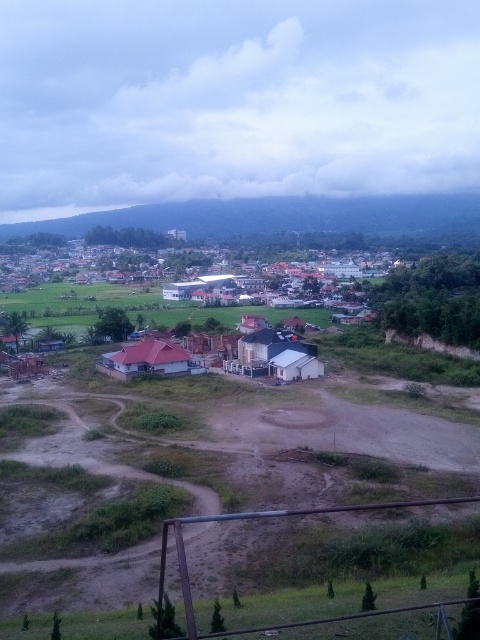
Can you confirm if dull brown dirt field at center is positioned below white matte house at center?

Correct, dull brown dirt field at center is located below white matte house at center.

Describe the element at coordinates (331, 444) in the screenshot. I see `dull brown dirt field at center` at that location.

At what (x,y) coordinates should I click in order to perform the action: click on dull brown dirt field at center. Please return your answer as a coordinate pair (x, y). The height and width of the screenshot is (640, 480). Looking at the image, I should click on (331, 444).